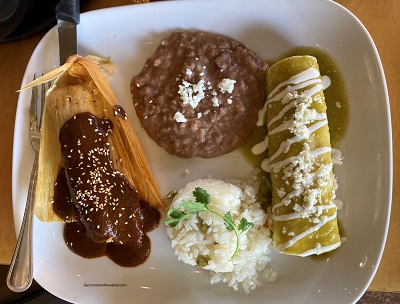
Identify the location of sharp silver blade of knife, left side. (69, 44).